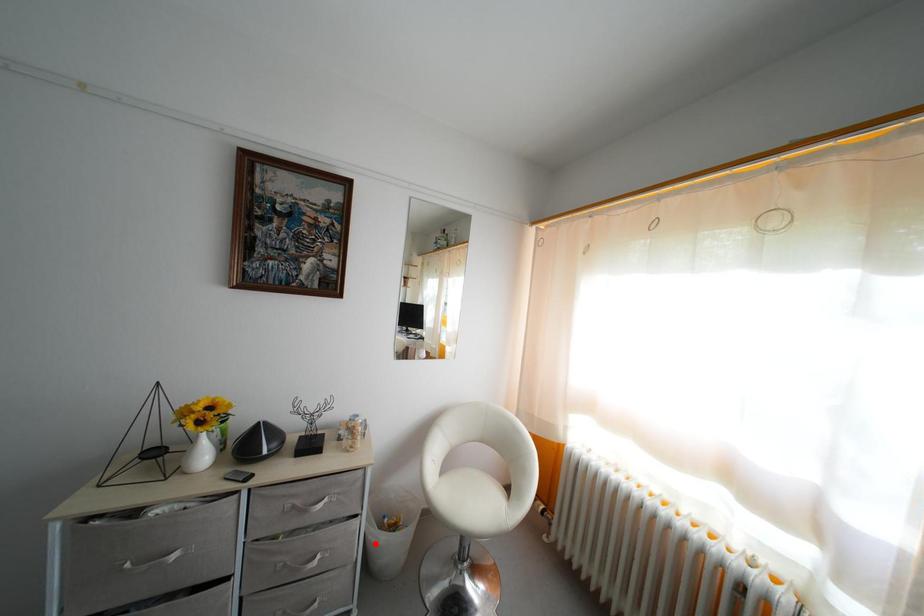
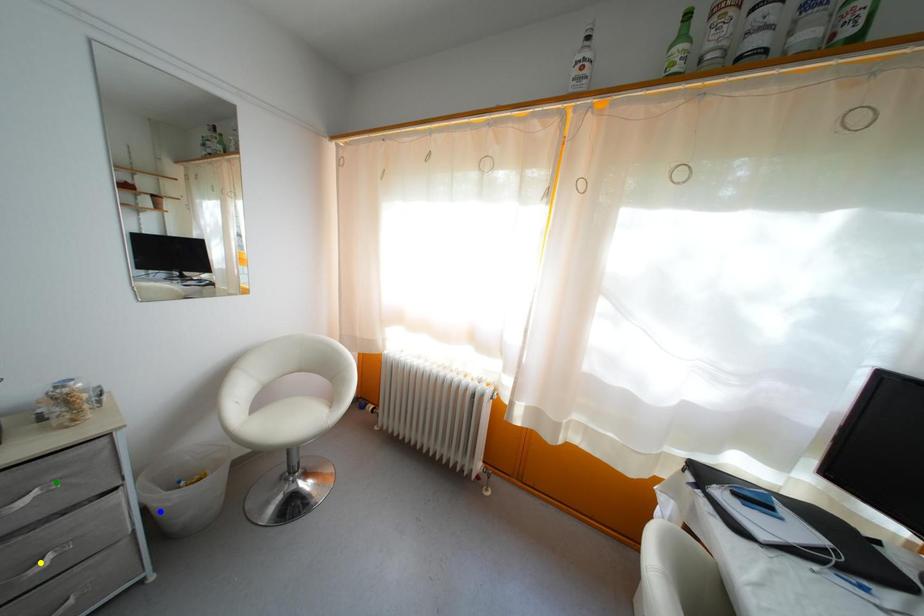
Question: I am providing you with two images of the same scene from different viewpoints. A red point is marked on the first image. You are given multiple points on the second image. Which point in image 2 is actually the same real-world point as the red point in image 1?

Choices:
 (A) yellow point
 (B) blue point
 (C) green point

Answer: (B)